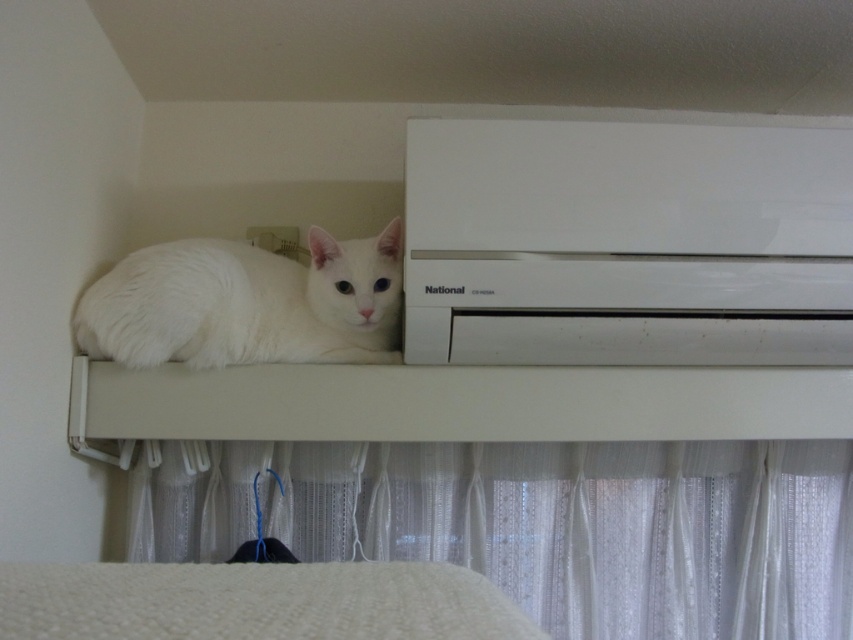
Is sheer white curtain at lower center positioned behind white fluffy cat at upper center?

Yes.

Who is more distant from viewer, (798, 586) or (282, 268)?

The point (798, 586) is more distant.

I want to click on sheer white curtain at lower center, so click(x=544, y=524).